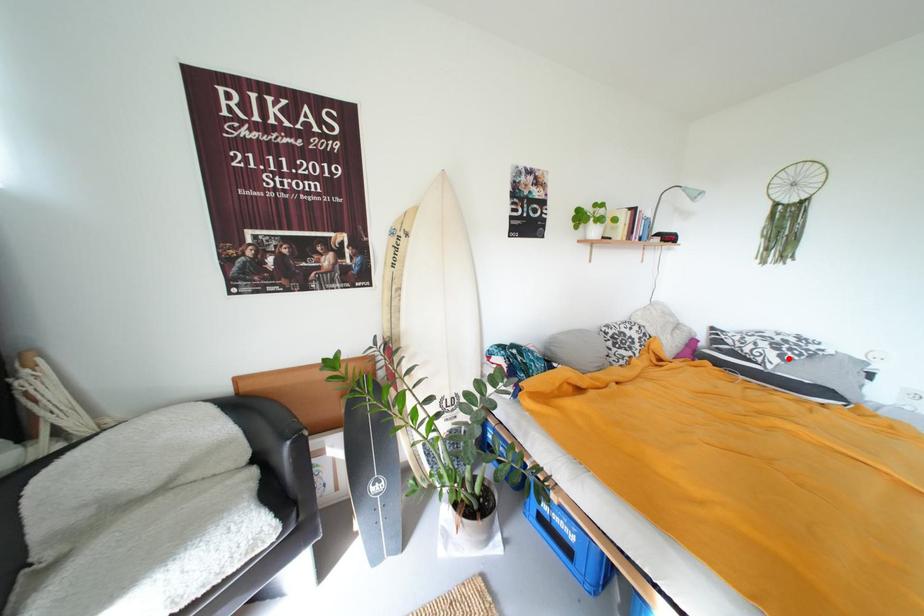
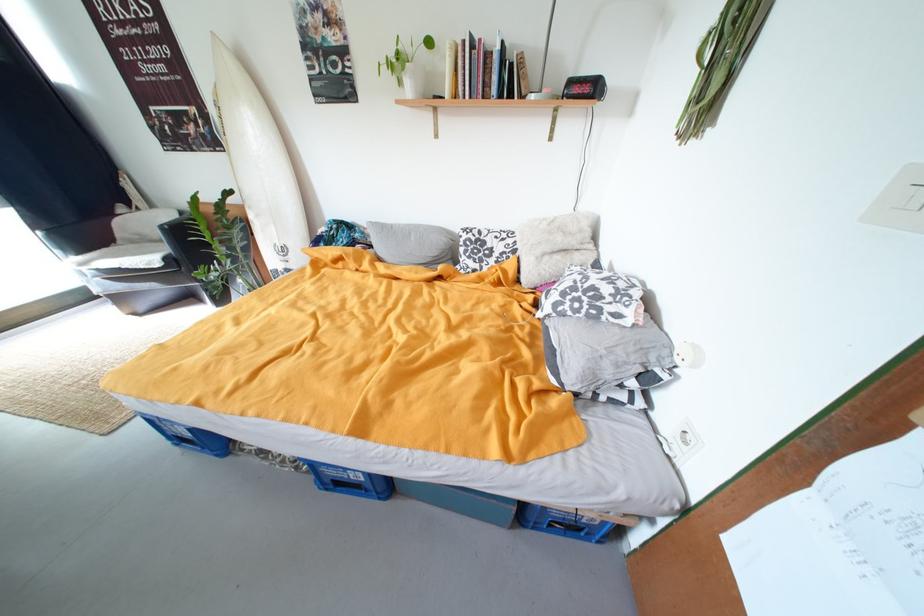
Where in the second image is the point corresponding to the highlighted location from the first image?

(564, 306)